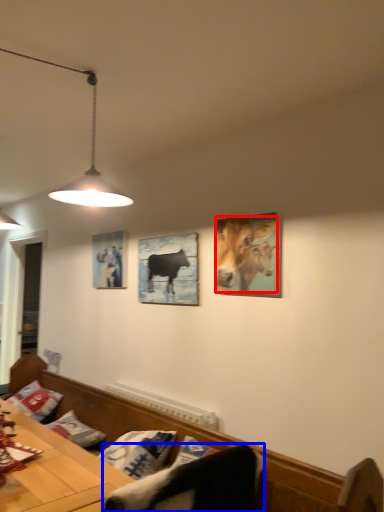
Question: Which object appears closest to the camera in this image, cattle (highlighted by a red box) or swivel chair (highlighted by a blue box)?

Choices:
 (A) cattle
 (B) swivel chair

Answer: (B)